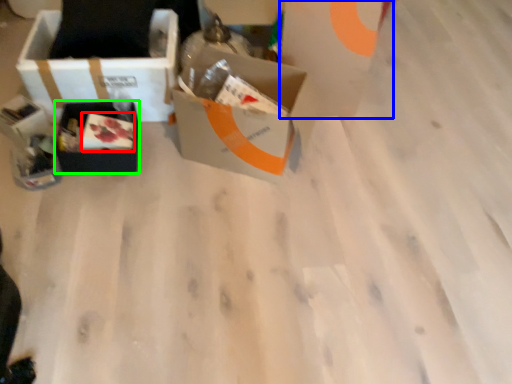
Question: Based on their relative distances, which object is farther from food (highlighted by a red box)? Choose from cardboard box (highlighted by a blue box) and box (highlighted by a green box).

Choices:
 (A) cardboard box
 (B) box

Answer: (A)